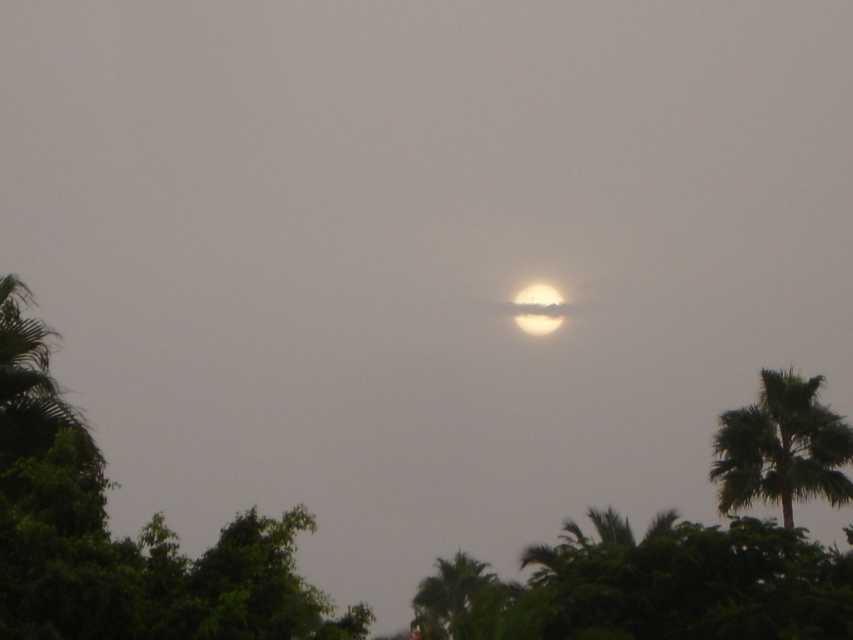
You are an astronomer observing the sky and notice the fuzzy white sun at center and the matte yellow moon at center. Based on their positions, which celestial body is farther away from your viewpoint?

The matte yellow moon at center is farther away because it is positioned behind the fuzzy white sun at center in the image.

You are an astronomer observing the sky and notice the green leafy palm tree at lower center and the fuzzy white sun at center. Which object appears larger in the image?

The green leafy palm tree at lower center is taller than the fuzzy white sun at center, so it appears larger in the image.